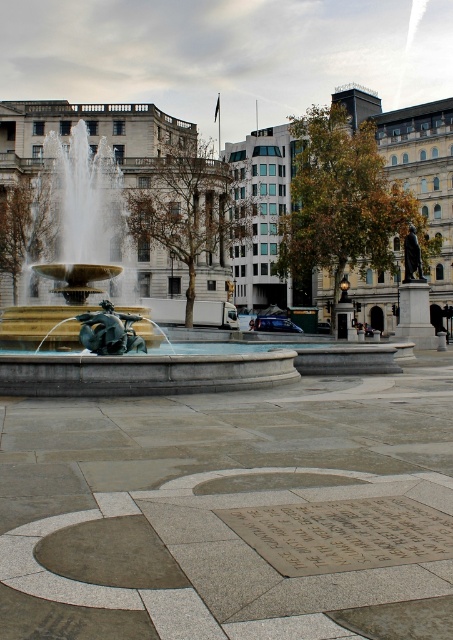
Question: Can you confirm if gold polished stone fountain at center is wider than bronze plaque at center?

Choices:
 (A) no
 (B) yes

Answer: (B)

Question: Which point is closer to the camera?

Choices:
 (A) (67, 374)
 (B) (411, 522)

Answer: (B)

Question: Among these points, which one is nearest to the camera?

Choices:
 (A) (88, 257)
 (B) (389, 556)

Answer: (B)

Question: Does gold polished stone fountain at center appear on the right side of bronze plaque at center?

Choices:
 (A) no
 (B) yes

Answer: (A)

Question: Does gold polished stone fountain at center appear on the right side of bronze plaque at center?

Choices:
 (A) yes
 (B) no

Answer: (B)